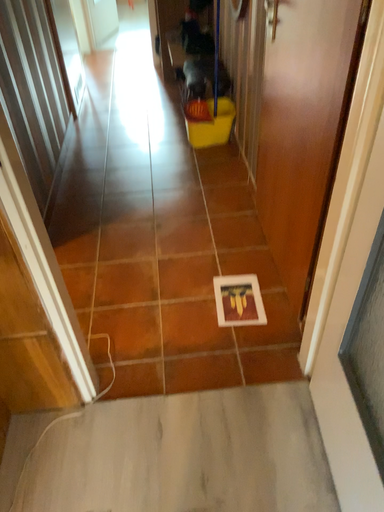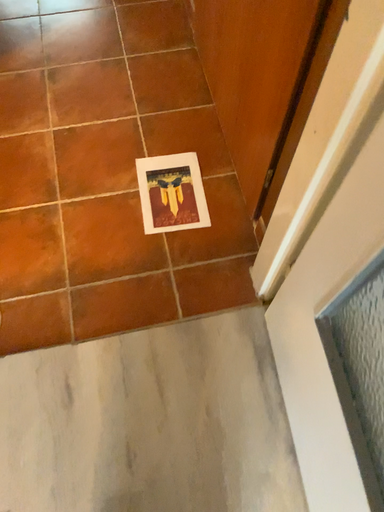
Question: How did the camera likely rotate when shooting the video?

Choices:
 (A) rotated upward
 (B) rotated downward

Answer: (B)